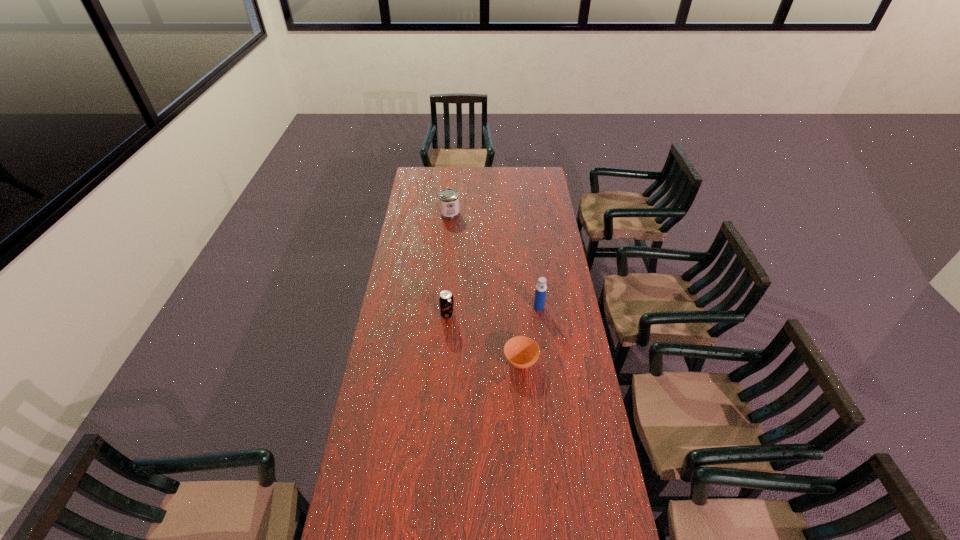
The width and height of the screenshot is (960, 540). What are the coordinates of `object that is the second closest to the farthest object` in the screenshot? It's located at (541, 288).

Locate which object ranks in proximity to the tallest object. Please provide its 2D coordinates. Your answer should be formatted as a tuple, i.e. [(x, y)], where the tuple contains the x and y coordinates of a point satisfying the conditions above.

[(522, 352)]

Locate an element on the screen. vacant area in the image that satisfies the following two spatial constraints: 1. on the front side of the rightmost object; 2. on the right side of the can is located at coordinates (442, 307).

I want to click on vacant area that satisfies the following two spatial constraints: 1. on the front side of the soda can; 2. on the right side of the nearest object, so click(444, 361).

Locate an element on the screen. This screenshot has width=960, height=540. vacant region that satisfies the following two spatial constraints: 1. on the back side of the shortest object; 2. on the right side of the rightmost object is located at coordinates (516, 307).

You are a GUI agent. You are given a task and a screenshot of the screen. Output one action in this format:
    pyautogui.click(x=<x>, y=<y>)
    Task: Click on the free location that satisfies the following two spatial constraints: 1. on the front side of the tallest object; 2. on the right side of the can
    The image size is (960, 540).
    Given the screenshot: What is the action you would take?
    pyautogui.click(x=442, y=307)